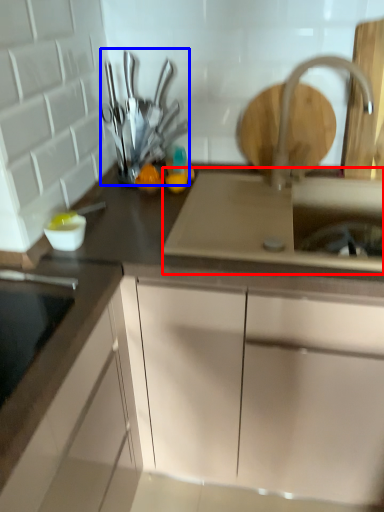
Question: Which object is closer to the camera taking this photo, sink (highlighted by a red box) or tableware (highlighted by a blue box)?

Choices:
 (A) sink
 (B) tableware

Answer: (A)